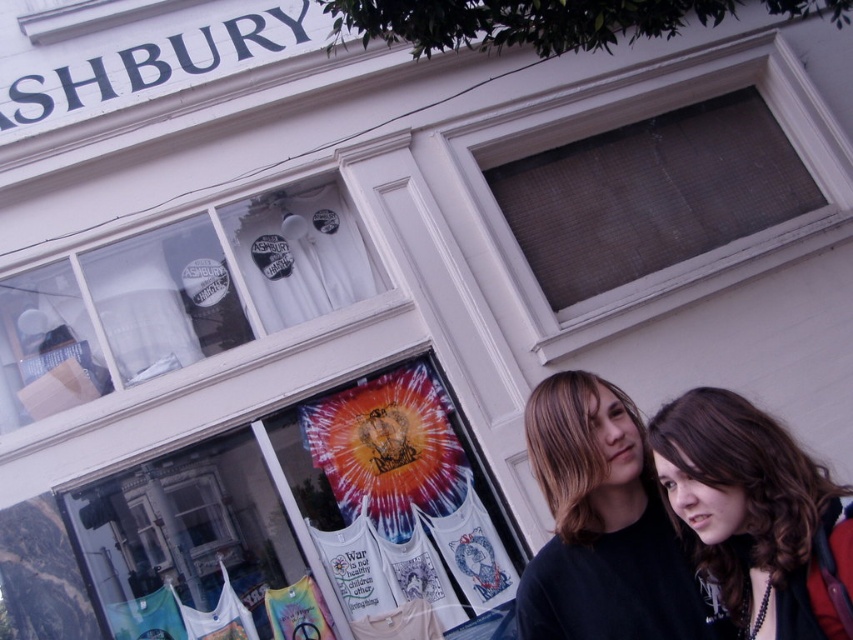
Question: Can you confirm if white frosted glass at upper center is smaller than matte glass window at upper center?

Choices:
 (A) no
 (B) yes

Answer: (B)

Question: Among these objects, which one is nearest to the camera?

Choices:
 (A) brown curly hair at center
 (B) matte glass window at upper center
 (C) brown hair at center

Answer: (A)

Question: Among these points, which one is farthest from the camera?

Choices:
 (A) (686, 605)
 (B) (598, 477)

Answer: (A)

Question: Does white frosted glass at upper center have a greater width compared to brown curly hair at center?

Choices:
 (A) yes
 (B) no

Answer: (A)

Question: Can you confirm if matte black shirt at center is positioned to the right of brown curly hair at center?

Choices:
 (A) yes
 (B) no

Answer: (B)

Question: Among these points, which one is farthest from the camera?

Choices:
 (A) (666, 163)
 (B) (566, 515)
 (C) (747, 605)
 (D) (560, 372)

Answer: (A)